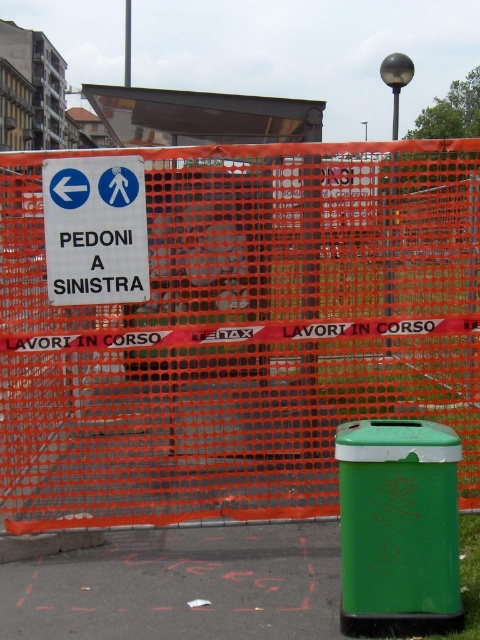
Question: Is orange mesh fence at center closer to the viewer compared to white plastic sign at upper left?

Choices:
 (A) no
 (B) yes

Answer: (B)

Question: Can you confirm if orange mesh fence at center is bigger than green asphalt pavement at lower right?

Choices:
 (A) yes
 (B) no

Answer: (A)

Question: Which object appears farthest from the camera in this image?

Choices:
 (A) green asphalt pavement at lower right
 (B) orange mesh fence at center
 (C) white plastic sign at upper left

Answer: (C)

Question: In this image, where is green asphalt pavement at lower right located relative to white plastic sign at upper left?

Choices:
 (A) above
 (B) below

Answer: (B)

Question: Which is farther from the white plastic sign at upper left?

Choices:
 (A) green asphalt pavement at lower right
 (B) orange mesh fence at center

Answer: (A)

Question: Which of the following is the closest to the observer?

Choices:
 (A) (468, 323)
 (B) (84, 228)
 (C) (327, 563)

Answer: (B)